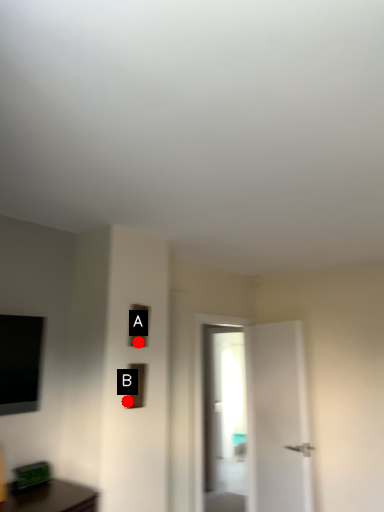
Question: Two points are circled on the image, labeled by A and B beside each circle. Which point is farther to the camera?

Choices:
 (A) A is further
 (B) B is further

Answer: (A)